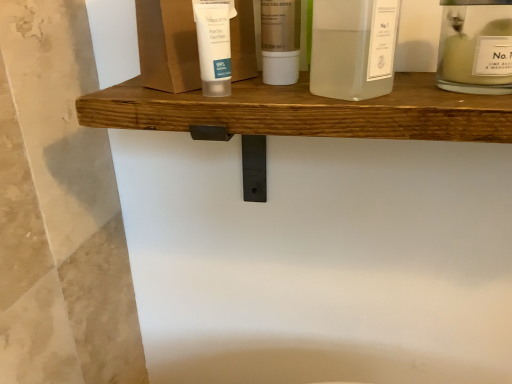
This screenshot has width=512, height=384. Describe the element at coordinates (353, 48) in the screenshot. I see `translucent glass bottle at center, which is the 1th product in right-to-left order` at that location.

What are the coordinates of `white matte tube at center, the first toiletry positioned from the left` in the screenshot? It's located at (214, 44).

What is the approximate width of translucent plastic bottle at center, arranged as the 2th toiletry when viewed from the right?

The width of translucent plastic bottle at center, arranged as the 2th toiletry when viewed from the right, is 2.45 inches.

What do you see at coordinates (168, 45) in the screenshot? Image resolution: width=512 pixels, height=384 pixels. I see `translucent plastic tube at upper center, acting as the 1th product starting from the left` at bounding box center [168, 45].

How much space does translucent plastic tube at upper center, acting as the 1th product starting from the left, occupy vertically?

The height of translucent plastic tube at upper center, acting as the 1th product starting from the left, is 23.16 centimeters.

What is the approximate height of clear glass jar at upper right, the third toiletry from the left?

clear glass jar at upper right, the third toiletry from the left, is 4.05 inches tall.

At what (x,y) coordinates should I click in order to perform the action: click on translucent glass bottle at center, which is the 1th product in right-to-left order. Please return your answer as a coordinate pair (x, y). The image size is (512, 384). Looking at the image, I should click on (353, 48).

From the image's perspective, which is above, translucent plastic bottle at center, positioned as the 2th toiletry in left-to-right order, or white matte tube at center, the first toiletry positioned from the left?

translucent plastic bottle at center, positioned as the 2th toiletry in left-to-right order, appears higher in the image.

Is white matte tube at center, the first toiletry positioned from the left, inside translucent plastic bottle at center, arranged as the 2th toiletry when viewed from the right?

Definitely not — white matte tube at center, the first toiletry positioned from the left, is not inside translucent plastic bottle at center, arranged as the 2th toiletry when viewed from the right.

Which object is thinner, translucent plastic bottle at center, arranged as the 2th toiletry when viewed from the right, or white matte tube at center, the first toiletry positioned from the left?

Thinner between the two is white matte tube at center, the first toiletry positioned from the left.

Does translucent plastic bottle at center, arranged as the 2th toiletry when viewed from the right, turn towards white matte tube at center, placed as the third toiletry when sorted from right to left?

No, translucent plastic bottle at center, arranged as the 2th toiletry when viewed from the right, does not turn towards white matte tube at center, placed as the third toiletry when sorted from right to left.

Is white matte tube at center, placed as the third toiletry when sorted from right to left, far from translucent plastic tube at upper center, acting as the 1th product starting from the left?

Actually, white matte tube at center, placed as the third toiletry when sorted from right to left, and translucent plastic tube at upper center, acting as the 1th product starting from the left, are a little close together.

In the image, is white matte tube at center, the first toiletry positioned from the left, positioned in front of or behind translucent plastic tube at upper center, the 2th product positioned from the right?

Clearly, white matte tube at center, the first toiletry positioned from the left, is behind translucent plastic tube at upper center, the 2th product positioned from the right.

Can you confirm if white matte tube at center, the first toiletry positioned from the left, is shorter than translucent plastic tube at upper center, acting as the 1th product starting from the left?

Yes.

Does white matte tube at center, the first toiletry positioned from the left, turn towards translucent plastic tube at upper center, the 2th product positioned from the right?

No, white matte tube at center, the first toiletry positioned from the left, is not aimed at translucent plastic tube at upper center, the 2th product positioned from the right.

From the image's perspective, which object appears higher, translucent plastic tube at upper center, the 2th product positioned from the right, or translucent glass bottle at center, which is the second product from left to right?

From the image's view, translucent plastic tube at upper center, the 2th product positioned from the right, is above.

Is the position of translucent plastic tube at upper center, the 2th product positioned from the right, less distant than that of translucent glass bottle at center, which is the second product from left to right?

No, translucent plastic tube at upper center, the 2th product positioned from the right, is further to the viewer.

Is translucent plastic tube at upper center, the 2th product positioned from the right, at the right side of translucent glass bottle at center, which is the 1th product in right-to-left order?

Incorrect, translucent plastic tube at upper center, the 2th product positioned from the right, is not on the right side of translucent glass bottle at center, which is the 1th product in right-to-left order.

Looking at this image, would you say clear glass jar at upper right, the first toiletry when ordered from right to left, is outside translucent plastic bottle at center, arranged as the 2th toiletry when viewed from the right?

Indeed, clear glass jar at upper right, the first toiletry when ordered from right to left, is completely outside translucent plastic bottle at center, arranged as the 2th toiletry when viewed from the right.

From the image's perspective, count 1st toiletrys downward from the translucent plastic bottle at center, arranged as the 2th toiletry when viewed from the right, and point to it. Please provide its 2D coordinates.

[(476, 47)]

Would you say clear glass jar at upper right, the third toiletry from the left, is a long distance from translucent plastic bottle at center, positioned as the 2th toiletry in left-to-right order?

That's not correct — clear glass jar at upper right, the third toiletry from the left, is a little close to translucent plastic bottle at center, positioned as the 2th toiletry in left-to-right order.

Is the surface of white matte tube at center, the first toiletry positioned from the left, in direct contact with clear glass jar at upper right, the first toiletry when ordered from right to left?

No, white matte tube at center, the first toiletry positioned from the left, is not touching clear glass jar at upper right, the first toiletry when ordered from right to left.

Is the depth of white matte tube at center, placed as the third toiletry when sorted from right to left, greater than that of clear glass jar at upper right, the first toiletry when ordered from right to left?

Yes, it is.

Is white matte tube at center, placed as the third toiletry when sorted from right to left, turned away from clear glass jar at upper right, the third toiletry from the left?

No, white matte tube at center, placed as the third toiletry when sorted from right to left, is not facing the opposite direction of clear glass jar at upper right, the third toiletry from the left.

Could you tell me if translucent plastic tube at upper center, the 2th product positioned from the right, is facing clear glass jar at upper right, the first toiletry when ordered from right to left?

No, translucent plastic tube at upper center, the 2th product positioned from the right, is not aimed at clear glass jar at upper right, the first toiletry when ordered from right to left.

Between translucent plastic tube at upper center, the 2th product positioned from the right, and clear glass jar at upper right, the first toiletry when ordered from right to left, which one has smaller size?

clear glass jar at upper right, the first toiletry when ordered from right to left.

Is translucent plastic tube at upper center, the 2th product positioned from the right, outside of clear glass jar at upper right, the first toiletry when ordered from right to left?

Yes.

Image resolution: width=512 pixels, height=384 pixels. There is a translucent plastic tube at upper center, the 2th product positioned from the right. What are the coordinates of `the 3rd toiletry below it (from a real-world perspective)` in the screenshot? It's located at (476, 47).

From a real-world perspective, which object stands above the other?

translucent plastic tube at upper center, acting as the 1th product starting from the left.

Is translucent plastic tube at upper center, the 2th product positioned from the right, far from white matte tube at center, the first toiletry positioned from the left?

No, there isn't a large distance between translucent plastic tube at upper center, the 2th product positioned from the right, and white matte tube at center, the first toiletry positioned from the left.

Between translucent plastic tube at upper center, acting as the 1th product starting from the left, and white matte tube at center, placed as the third toiletry when sorted from right to left, which one has smaller size?

white matte tube at center, placed as the third toiletry when sorted from right to left, is smaller.

Locate an element on the screen. The height and width of the screenshot is (384, 512). the 1st toiletry counting from the right of the white matte tube at center, placed as the third toiletry when sorted from right to left is located at coordinates (280, 41).

From the image's perspective, starting from the translucent plastic tube at upper center, acting as the 1th product starting from the left, which toiletry is the 3rd one below? Please provide its 2D coordinates.

[(214, 44)]

From the image, which object appears to be nearer to translucent plastic tube at upper center, the 2th product positioned from the right, translucent glass bottle at center, which is the second product from left to right, or translucent plastic bottle at center, positioned as the 2th toiletry in left-to-right order?

translucent plastic bottle at center, positioned as the 2th toiletry in left-to-right order, lies closer to translucent plastic tube at upper center, the 2th product positioned from the right, than the other object.

From the image, which object appears to be farther from clear glass jar at upper right, the third toiletry from the left, translucent glass bottle at center, which is the 1th product in right-to-left order, or white matte tube at center, the first toiletry positioned from the left?

white matte tube at center, the first toiletry positioned from the left, is positioned further to the anchor clear glass jar at upper right, the third toiletry from the left.

Which object lies further to the anchor point translucent plastic tube at upper center, acting as the 1th product starting from the left, white matte tube at center, placed as the third toiletry when sorted from right to left, or translucent plastic bottle at center, arranged as the 2th toiletry when viewed from the right?

translucent plastic bottle at center, arranged as the 2th toiletry when viewed from the right, is further to translucent plastic tube at upper center, acting as the 1th product starting from the left.

Based on their spatial positions, is clear glass jar at upper right, the third toiletry from the left, or white matte tube at center, the first toiletry positioned from the left, further from translucent plastic bottle at center, positioned as the 2th toiletry in left-to-right order?

clear glass jar at upper right, the third toiletry from the left, is further to translucent plastic bottle at center, positioned as the 2th toiletry in left-to-right order.

Based on their spatial positions, is translucent glass bottle at center, which is the second product from left to right, or white matte tube at center, placed as the third toiletry when sorted from right to left, further from translucent plastic tube at upper center, acting as the 1th product starting from the left?

translucent glass bottle at center, which is the second product from left to right, lies further to translucent plastic tube at upper center, acting as the 1th product starting from the left, than the other object.

Looking at this image, based on their spatial positions, is translucent plastic bottle at center, arranged as the 2th toiletry when viewed from the right, or translucent plastic tube at upper center, acting as the 1th product starting from the left, further from white matte tube at center, the first toiletry positioned from the left?

translucent plastic bottle at center, arranged as the 2th toiletry when viewed from the right.

Estimate the real-world distances between objects in this image. Which object is further from clear glass jar at upper right, the first toiletry when ordered from right to left, translucent plastic tube at upper center, the 2th product positioned from the right, or white matte tube at center, the first toiletry positioned from the left?

Among the two, white matte tube at center, the first toiletry positioned from the left, is located further to clear glass jar at upper right, the first toiletry when ordered from right to left.

Estimate the real-world distances between objects in this image. Which object is further from translucent glass bottle at center, which is the second product from left to right, translucent plastic tube at upper center, acting as the 1th product starting from the left, or translucent plastic bottle at center, arranged as the 2th toiletry when viewed from the right?

Based on the image, translucent plastic tube at upper center, acting as the 1th product starting from the left, appears to be further to translucent glass bottle at center, which is the second product from left to right.

What are the coordinates of `product between white matte tube at center, placed as the third toiletry when sorted from right to left, and clear glass jar at upper right, the first toiletry when ordered from right to left` in the screenshot? It's located at (353, 48).

The height and width of the screenshot is (384, 512). I want to click on toiletry located between translucent plastic tube at upper center, acting as the 1th product starting from the left, and translucent plastic bottle at center, arranged as the 2th toiletry when viewed from the right, in the left-right direction, so click(214, 44).

The width and height of the screenshot is (512, 384). I want to click on product situated between translucent plastic tube at upper center, the 2th product positioned from the right, and clear glass jar at upper right, the first toiletry when ordered from right to left, from left to right, so click(353, 48).

At what (x,y) coordinates should I click in order to perform the action: click on product between translucent plastic bottle at center, positioned as the 2th toiletry in left-to-right order, and clear glass jar at upper right, the third toiletry from the left. Please return your answer as a coordinate pair (x, y). The width and height of the screenshot is (512, 384). Looking at the image, I should click on (353, 48).